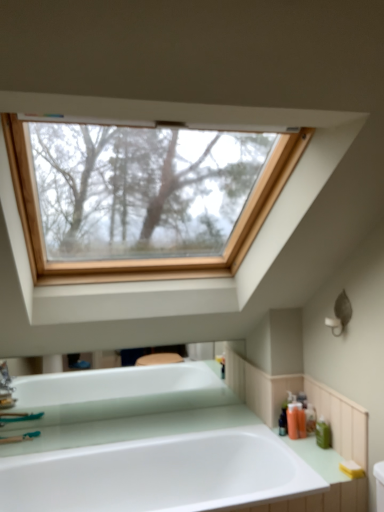
Find the location of a particular element. This screenshot has width=384, height=512. vacant space that is to the left of orange matte bottle at lower right, which is the third toiletry in back-to-front order is located at coordinates (269, 433).